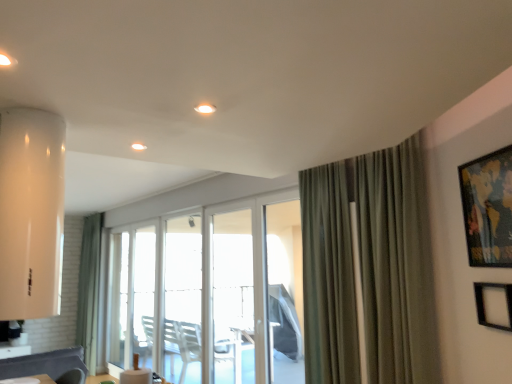
Question: Is clear glass screen door at center, which is the second screen door in right-to-left order, located outside green fabric curtain at left, the second curtain from the front?

Choices:
 (A) yes
 (B) no

Answer: (A)

Question: From the image's perspective, is clear glass screen door at center, the 1th screen door in the left-to-right sequence, located above green fabric curtain at left, the second curtain from the front?

Choices:
 (A) no
 (B) yes

Answer: (B)

Question: From a real-world perspective, is clear glass screen door at center, the 1th screen door in the left-to-right sequence, beneath green fabric curtain at left, which appears as the second curtain when viewed from the right?

Choices:
 (A) no
 (B) yes

Answer: (A)

Question: Does clear glass screen door at center, the 1th screen door in the left-to-right sequence, have a lesser height compared to green fabric curtain at left, which appears as the second curtain when viewed from the right?

Choices:
 (A) yes
 (B) no

Answer: (A)

Question: Considering the relative positions of clear glass screen door at center, which is the second screen door in right-to-left order, and green fabric curtain at left, which appears as the second curtain when viewed from the right, in the image provided, is clear glass screen door at center, which is the second screen door in right-to-left order, behind green fabric curtain at left, which appears as the second curtain when viewed from the right,?

Choices:
 (A) yes
 (B) no

Answer: (B)

Question: Considering the relative sizes of clear glass screen door at center, which is the second screen door in right-to-left order, and green fabric curtain at left, which is the first curtain in back-to-front order, in the image provided, is clear glass screen door at center, which is the second screen door in right-to-left order, taller than green fabric curtain at left, which is the first curtain in back-to-front order,?

Choices:
 (A) yes
 (B) no

Answer: (B)

Question: Is white glossy light fixture at upper center, which is the 2th light from left to right, surrounding clear glass door at center?

Choices:
 (A) no
 (B) yes

Answer: (A)

Question: Is white glossy light fixture at upper center, acting as the 2th light starting from the back, to the left of clear glass door at center from the viewer's perspective?

Choices:
 (A) no
 (B) yes

Answer: (A)

Question: Is white glossy light fixture at upper center, which is counted as the first light, starting from the front, taller than clear glass door at center?

Choices:
 (A) no
 (B) yes

Answer: (A)

Question: Considering the relative sizes of white glossy light fixture at upper center, acting as the 2th light starting from the back, and clear glass door at center in the image provided, is white glossy light fixture at upper center, acting as the 2th light starting from the back, shorter than clear glass door at center?

Choices:
 (A) no
 (B) yes

Answer: (B)

Question: Is white glossy light fixture at upper center, placed as the first light when sorted from top to bottom, placed right next to clear glass door at center?

Choices:
 (A) no
 (B) yes

Answer: (A)

Question: Is the depth of white glossy light fixture at upper center, placed as the first light when sorted from top to bottom, less than that of clear glass door at center?

Choices:
 (A) yes
 (B) no

Answer: (A)

Question: From a real-world perspective, is clear glass door at center beneath transparent plastic screen door at center, arranged as the second screen door when viewed from the left?

Choices:
 (A) yes
 (B) no

Answer: (A)